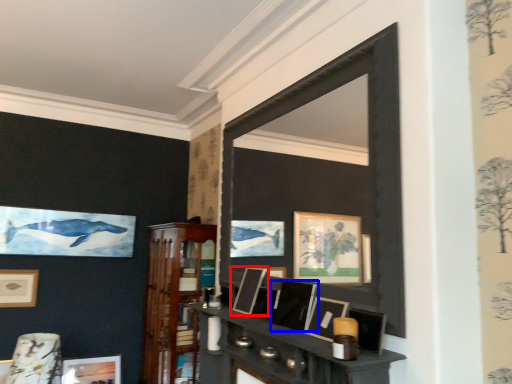
Question: Which object is further to the camera taking this photo, picture frame (highlighted by a red box) or picture frame (highlighted by a blue box)?

Choices:
 (A) picture frame
 (B) picture frame

Answer: (A)